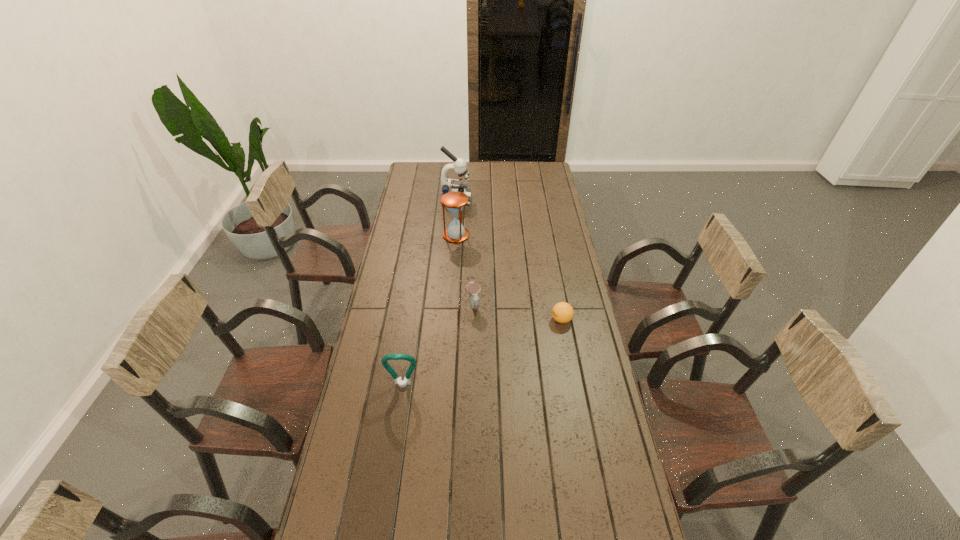
In the image, there is a desktop. What are the coordinates of `blank space at the far right corner` in the screenshot? It's located at (528, 176).

Identify the location of vacant area that lies between the nearest object and the hourglass. (429, 310).

The width and height of the screenshot is (960, 540). In order to click on free space between the hourglass and the shortest object in this screenshot , I will do `click(509, 278)`.

Find the location of a particular element. vacant space that is in between the bottle opener and the farthest object is located at coordinates (429, 292).

Where is `free point between the fourth tallest object and the tallest object`? This screenshot has width=960, height=540. free point between the fourth tallest object and the tallest object is located at coordinates (465, 252).

Find the location of a particular element. This screenshot has height=540, width=960. empty location between the hourglass and the rightmost object is located at coordinates [509, 278].

Identify the location of free space that is in between the microscope and the hourglass. The width and height of the screenshot is (960, 540). (456, 217).

I want to click on free space between the ping-pong ball and the tallest object, so click(x=509, y=260).

What are the coordinates of `vacant area that lies between the shortest object and the watch` in the screenshot? It's located at (517, 313).

Where is `vacant area between the rightmost object and the nearest object`? The height and width of the screenshot is (540, 960). vacant area between the rightmost object and the nearest object is located at coordinates (482, 353).